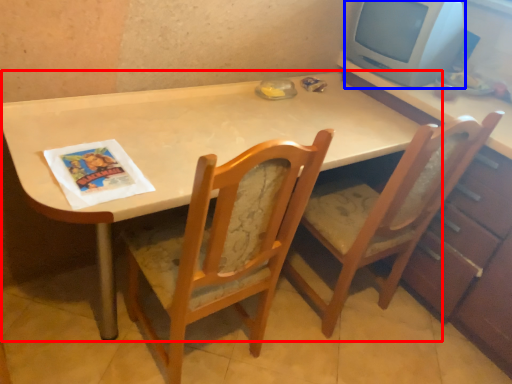
Question: Which object is further to the camera taking this photo, table (highlighted by a red box) or computer monitor (highlighted by a blue box)?

Choices:
 (A) table
 (B) computer monitor

Answer: (B)